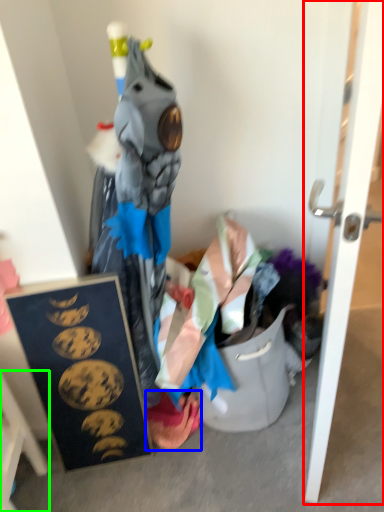
Question: Which object is positioned closest to door (highlighted by a red box)? Select from underclothes (highlighted by a blue box) and furniture (highlighted by a green box).

Choices:
 (A) underclothes
 (B) furniture

Answer: (A)